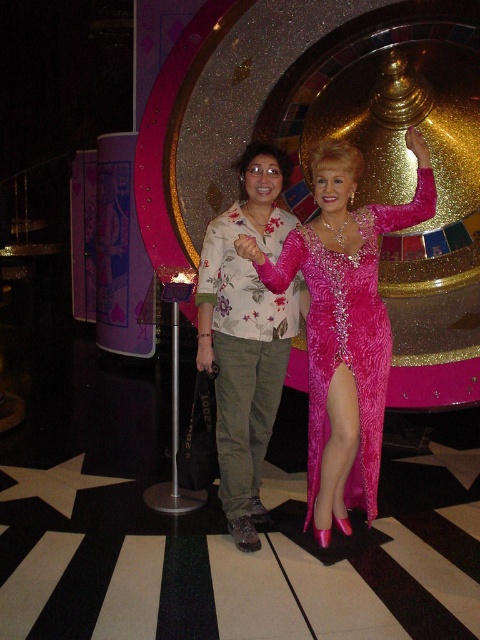
You are a photographer trying to adjust the lighting for a photo shoot. You notice two items at the center of the image, the floral print shirt at center and the shiny pink fabric dress at center. Which item should you focus your spotlight on if you want to highlight the one that is positioned higher?

The floral print shirt at center is above the shiny pink fabric dress at center, so you should focus your spotlight on the floral print shirt at center to highlight the higher positioned item.

You are taking a picture of the two people standing in front of the casino roulette wheel. You want to focus on the person closer to the camera. Which of the two points, point (x=263, y=323) or point (x=312, y=225), should you focus on?

You should focus on point (x=263, y=323) because it is closer to the camera than point (x=312, y=225).